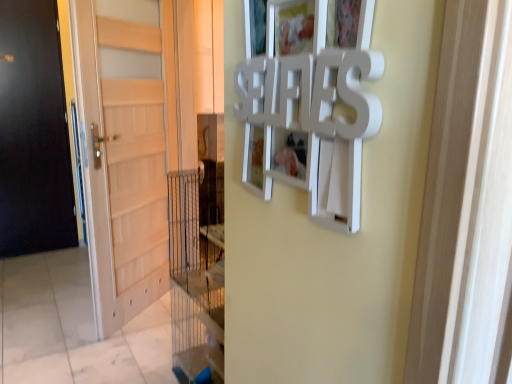
Question: Can you confirm if matte wood door at left is smaller than white matte picture frame at upper center?

Choices:
 (A) yes
 (B) no

Answer: (B)

Question: From the image's perspective, is matte wood door at left located above white matte picture frame at upper center?

Choices:
 (A) yes
 (B) no

Answer: (B)

Question: Is the depth of matte wood door at left greater than that of white matte picture frame at upper center?

Choices:
 (A) yes
 (B) no

Answer: (A)

Question: Is there a large distance between matte wood door at left and white matte picture frame at upper center?

Choices:
 (A) yes
 (B) no

Answer: (A)

Question: From a real-world perspective, is matte wood door at left on white matte picture frame at upper center?

Choices:
 (A) yes
 (B) no

Answer: (B)

Question: From the image's perspective, is matte wood door at left under white matte picture frame at upper center?

Choices:
 (A) no
 (B) yes

Answer: (B)

Question: Is white matte picture frame at upper center at the right side of matte wood door at left?

Choices:
 (A) no
 (B) yes

Answer: (B)

Question: Are white matte picture frame at upper center and matte wood door at left far apart?

Choices:
 (A) yes
 (B) no

Answer: (A)

Question: Considering the relative sizes of white matte picture frame at upper center and matte wood door at left in the image provided, is white matte picture frame at upper center shorter than matte wood door at left?

Choices:
 (A) no
 (B) yes

Answer: (B)

Question: Can you confirm if white matte picture frame at upper center is wider than matte wood door at left?

Choices:
 (A) no
 (B) yes

Answer: (A)

Question: From a real-world perspective, is white matte picture frame at upper center positioned under matte wood door at left based on gravity?

Choices:
 (A) yes
 (B) no

Answer: (B)

Question: Can you confirm if white matte picture frame at upper center is smaller than matte wood door at left?

Choices:
 (A) no
 (B) yes

Answer: (B)

Question: Based on their positions, is white matte picture frame at upper center located to the left or right of matte wood door at left?

Choices:
 (A) left
 (B) right

Answer: (B)